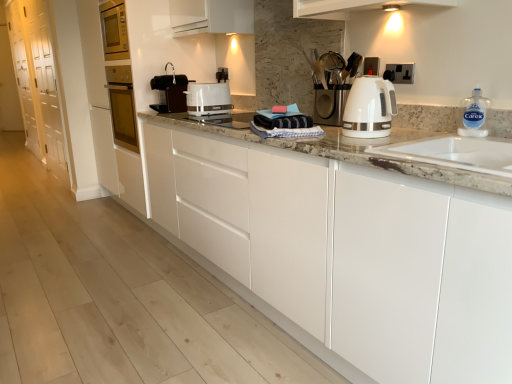
The image size is (512, 384). What do you see at coordinates (359, 257) in the screenshot?
I see `white glossy cabinets at center, which appears as the second cabinetry when viewed from the back` at bounding box center [359, 257].

The image size is (512, 384). I want to click on white glossy cabinets at center, marked as the 1th cabinetry in a front-to-back arrangement, so click(x=359, y=257).

Looking at this image, what is the approximate height of clear plastic bottle at right?

It is 6.86 inches.

Measure the distance between black plastic electric outlet at upper right and camera.

black plastic electric outlet at upper right and camera are 5.73 feet apart from each other.

Describe the element at coordinates (402, 72) in the screenshot. This screenshot has height=384, width=512. I see `black plastic electric outlet at upper right` at that location.

Find the location of a particular element. white glossy cabinets at center, marked as the 1th cabinetry in a front-to-back arrangement is located at coordinates (359, 257).

Measure the distance from clear plastic bottle at right to white marble sink at right.

clear plastic bottle at right is 9.11 inches from white marble sink at right.

Is clear plastic bottle at right behind white marble sink at right?

Yes.

This screenshot has width=512, height=384. I want to click on sink in front of the clear plastic bottle at right, so pyautogui.click(x=455, y=153).

Considering the positions of point (472, 116) and point (493, 155), is point (472, 116) closer or farther from the camera than point (493, 155)?

Clearly, point (472, 116) is more distant from the camera than point (493, 155).

Which of these two, clear plastic bottle at right or black plastic electric outlet at upper right, is bigger?

Bigger between the two is clear plastic bottle at right.

In the scene shown: Is clear plastic bottle at right aimed at black plastic electric outlet at upper right?

No, clear plastic bottle at right is not aimed at black plastic electric outlet at upper right.

Which of these two, clear plastic bottle at right or black plastic electric outlet at upper right, is thinner?

Thinner between the two is black plastic electric outlet at upper right.

From the image's perspective, between clear plastic bottle at right and black plastic electric outlet at upper right, which one is located above?

black plastic electric outlet at upper right appears higher in the image.

Is white marble sink at right not close to black plastic electric outlet at upper right?

No, there isn't a large distance between white marble sink at right and black plastic electric outlet at upper right.

Is white marble sink at right positioned with its back to black plastic electric outlet at upper right?

No, white marble sink at right is not facing away from black plastic electric outlet at upper right.

From the image's perspective, is white marble sink at right located above black plastic electric outlet at upper right?

No, from the image's perspective, white marble sink at right is not over black plastic electric outlet at upper right.

Is white glossy cabinets at center, marked as the 1th cabinetry in a front-to-back arrangement, behind clear plastic bottle at right?

No, white glossy cabinets at center, marked as the 1th cabinetry in a front-to-back arrangement, is in front of clear plastic bottle at right.

Considering the positions of point (483, 349) and point (462, 120), is point (483, 349) closer or farther from the camera than point (462, 120)?

Clearly, point (483, 349) is closer to the camera than point (462, 120).

Which of these two, white glossy cabinets at center, marked as the 1th cabinetry in a front-to-back arrangement, or clear plastic bottle at right, is smaller?

Smaller between the two is clear plastic bottle at right.

From a real-world perspective, which is physically below, white glossy cabinets at center, arranged as the 1th cabinetry when viewed from the right, or clear plastic bottle at right?

white glossy cabinets at center, arranged as the 1th cabinetry when viewed from the right, is physically lower.

Between black plastic coffee machine at center, which ranks as the first home appliance in top-to-bottom order, and black plastic electric outlet at upper right, which one appears on the left side from the viewer's perspective?

black plastic coffee machine at center, which ranks as the first home appliance in top-to-bottom order, is more to the left.

Would you consider black plastic coffee machine at center, which is the second home appliance from bottom to top, to be distant from black plastic electric outlet at upper right?

black plastic coffee machine at center, which is the second home appliance from bottom to top, is far away from black plastic electric outlet at upper right.

Considering the relative sizes of black plastic coffee machine at center, positioned as the 2th home appliance in front-to-back order, and black plastic electric outlet at upper right in the image provided, is black plastic coffee machine at center, positioned as the 2th home appliance in front-to-back order, wider than black plastic electric outlet at upper right?

Correct, the width of black plastic coffee machine at center, positioned as the 2th home appliance in front-to-back order, exceeds that of black plastic electric outlet at upper right.

Which is in front, black plastic coffee machine at center, which is the second home appliance from bottom to top, or black plastic electric outlet at upper right?

black plastic electric outlet at upper right.

Considering the positions of point (19, 50) and point (432, 159), is point (19, 50) closer or farther from the camera than point (432, 159)?

Clearly, point (19, 50) is more distant from the camera than point (432, 159).

Considering the relative positions of white glossy cabinet at left, the 1th cabinetry in the left-to-right sequence, and white marble sink at right in the image provided, is white glossy cabinet at left, the 1th cabinetry in the left-to-right sequence, to the right of white marble sink at right from the viewer's perspective?

No.

From a real-world perspective, is white glossy cabinet at left, the 1th cabinetry in the left-to-right sequence, physically located above or below white marble sink at right?

From a real-world perspective, white glossy cabinet at left, the 1th cabinetry in the left-to-right sequence, is physically above white marble sink at right.

From the image's perspective, is white glossy cabinets at center, arranged as the 1th cabinetry when viewed from the right, located beneath black plastic coffee machine at center, positioned as the 2th home appliance in front-to-back order?

Correct, white glossy cabinets at center, arranged as the 1th cabinetry when viewed from the right, appears lower than black plastic coffee machine at center, positioned as the 2th home appliance in front-to-back order, in the image.

There is a white glossy cabinets at center, which appears as the second cabinetry when viewed from the back. Identify the location of the 2nd home appliance above it (from the image's perspective). Image resolution: width=512 pixels, height=384 pixels. (170, 92).

Can you confirm if white glossy cabinets at center, arranged as the 1th cabinetry when viewed from the right, is wider than black plastic coffee machine at center, positioned as the 2th home appliance in front-to-back order?

Indeed, white glossy cabinets at center, arranged as the 1th cabinetry when viewed from the right, has a greater width compared to black plastic coffee machine at center, positioned as the 2th home appliance in front-to-back order.

Which is more to the right, white glossy cabinets at center, arranged as the 1th cabinetry when viewed from the right, or black plastic coffee machine at center, arranged as the 1th home appliance when viewed from the back?

white glossy cabinets at center, arranged as the 1th cabinetry when viewed from the right, is more to the right.

Find the location of `sink that is on the left side of clear plastic bottle at right`. sink that is on the left side of clear plastic bottle at right is located at coordinates (455, 153).

Find the location of `electric outlet that is above the clear plastic bottle at right (from the image's perspective)`. electric outlet that is above the clear plastic bottle at right (from the image's perspective) is located at coordinates (402, 72).

Considering their positions, is white glossy cabinet at left, placed as the first cabinetry when sorted from back to front, positioned closer to black plastic electric outlet at upper right than white marble sink at right?

Based on the image, white marble sink at right appears to be nearer to black plastic electric outlet at upper right.

Considering their positions, is white glossy toaster at center positioned closer to clear plastic bottle at right than black plastic electric outlet at upper right?

black plastic electric outlet at upper right is positioned closer to the anchor clear plastic bottle at right.

Estimate the real-world distances between objects in this image. Which object is further from white glossy cabinets at center, which appears as the second cabinetry when viewed from the back, white glossy cabinet at left, the 1th cabinetry in the left-to-right sequence, or white marble sink at right?

Among the two, white glossy cabinet at left, the 1th cabinetry in the left-to-right sequence, is located further to white glossy cabinets at center, which appears as the second cabinetry when viewed from the back.

Based on their spatial positions, is white glossy cabinets at center, arranged as the 1th cabinetry when viewed from the right, or black plastic coffee machine at center, which is counted as the second home appliance, starting from the right, further from white glossy cabinet at left, acting as the 2th cabinetry starting from the front?

white glossy cabinets at center, arranged as the 1th cabinetry when viewed from the right.

Estimate the real-world distances between objects in this image. Which object is further from white glossy electric kettle at right, marked as the second home appliance in a back-to-front arrangement, black plastic electric outlet at upper right or black plastic coffee machine at center, which is the second home appliance from bottom to top?

black plastic coffee machine at center, which is the second home appliance from bottom to top, lies further to white glossy electric kettle at right, marked as the second home appliance in a back-to-front arrangement, than the other object.

Based on the photo, estimate the real-world distances between objects in this image. Which object is closer to black plastic coffee machine at center, positioned as the 2th home appliance in front-to-back order, white glossy electric kettle at right, which appears as the 2th home appliance when viewed from the top, or white glossy toaster at center?

white glossy toaster at center is positioned closer to the anchor black plastic coffee machine at center, positioned as the 2th home appliance in front-to-back order.

Considering their positions, is white glossy electric kettle at right, marked as the first home appliance in a bottom-to-top arrangement, positioned closer to clear plastic bottle at right than white glossy cabinet at left, the 1th cabinetry in the left-to-right sequence?

white glossy electric kettle at right, marked as the first home appliance in a bottom-to-top arrangement, is closer to clear plastic bottle at right.

From the image, which object appears to be nearer to white marble sink at right, white glossy cabinets at center, arranged as the 1th cabinetry when viewed from the right, or white glossy electric kettle at right, which is counted as the first home appliance, starting from the right?

white glossy electric kettle at right, which is counted as the first home appliance, starting from the right.

Identify the location of cabinetry between white glossy cabinet at left, placed as the 2th cabinetry when sorted from right to left, and clear plastic bottle at right, in the horizontal direction. The image size is (512, 384). (359, 257).

Locate an element on the screen. The height and width of the screenshot is (384, 512). kitchen appliance located between white glossy cabinet at left, acting as the 2th cabinetry starting from the front, and white glossy electric kettle at right, marked as the first home appliance in a bottom-to-top arrangement, in the left-right direction is located at coordinates (208, 99).

This screenshot has height=384, width=512. In order to click on kitchen appliance between white glossy cabinet at left, the 1th cabinetry in the left-to-right sequence, and white marble sink at right, in the horizontal direction in this screenshot , I will do `click(208, 99)`.

The width and height of the screenshot is (512, 384). In order to click on sink between white glossy cabinets at center, arranged as the 1th cabinetry when viewed from the right, and clear plastic bottle at right in this screenshot , I will do `click(455, 153)`.